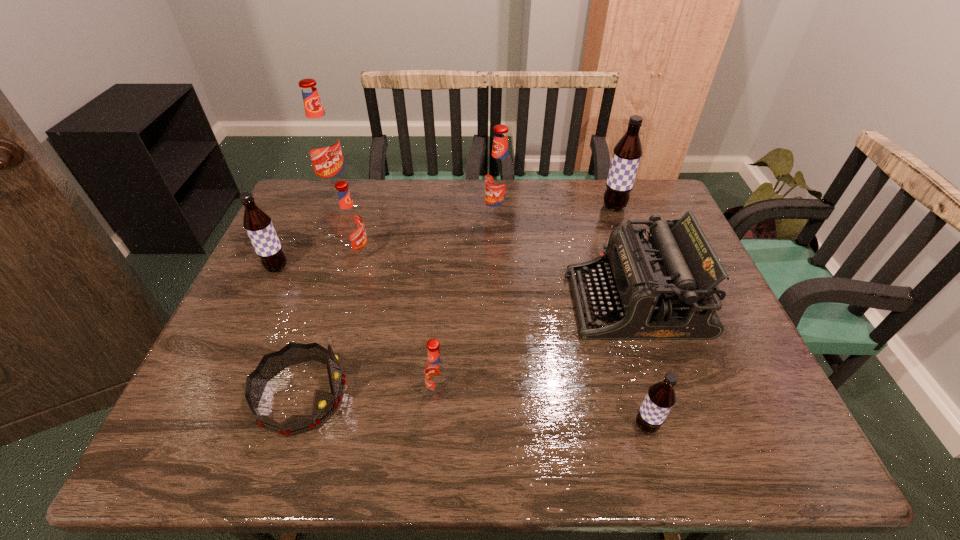
Where is `the leftmost red root beer`? The image size is (960, 540). the leftmost red root beer is located at coordinates click(x=323, y=144).

The width and height of the screenshot is (960, 540). I want to click on the tallest object, so click(323, 144).

Find the location of a particular element. the rightmost brown root beer is located at coordinates (627, 153).

Find the location of `the rightmost root beer`. the rightmost root beer is located at coordinates (627, 153).

Identify the location of the second farthest red root beer. The height and width of the screenshot is (540, 960). (499, 174).

Find the location of `the rightmost red root beer`. the rightmost red root beer is located at coordinates (499, 174).

At what (x,y) coordinates should I click in order to perform the action: click on the leftmost brown root beer. Please return your answer as a coordinate pair (x, y). The image size is (960, 540). Looking at the image, I should click on (257, 223).

The width and height of the screenshot is (960, 540). In order to click on the second nearest brown root beer in this screenshot , I will do `click(257, 223)`.

The height and width of the screenshot is (540, 960). What are the coordinates of `the second nearest red root beer` in the screenshot? It's located at (350, 222).

Find the location of `the second red root beer from left to right`. the second red root beer from left to right is located at coordinates (350, 222).